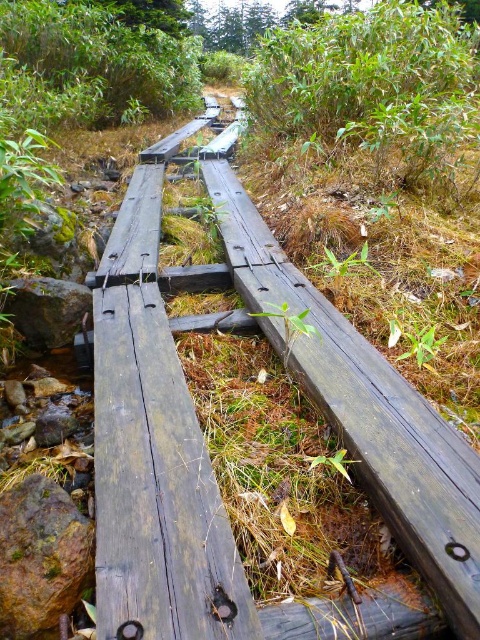
Question: Does weathered wood rail at center have a larger size compared to green mossy rock at center-left?

Choices:
 (A) yes
 (B) no

Answer: (A)

Question: Does weathered wood rail at center come in front of green mossy rock at center-left?

Choices:
 (A) no
 (B) yes

Answer: (B)

Question: Can you confirm if weathered wood rail at center is smaller than green mossy rock at center-left?

Choices:
 (A) no
 (B) yes

Answer: (A)